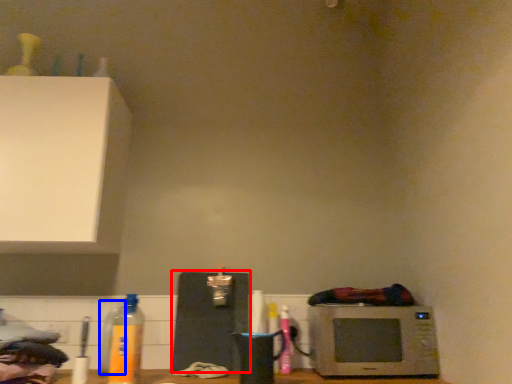
Question: Among these objects, which one is farthest to the camera, appliance (highlighted by a red box) or bottle (highlighted by a blue box)?

Choices:
 (A) appliance
 (B) bottle

Answer: (A)